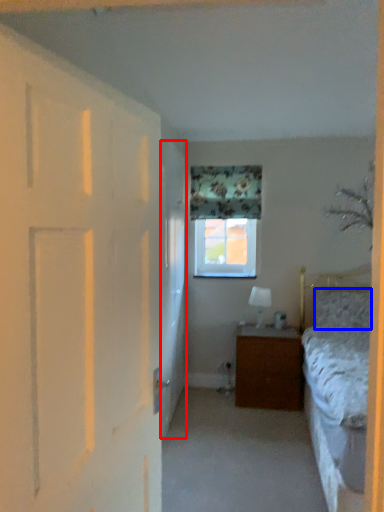
Question: Which point is closer to the camera, screen door (highlighted by a red box) or pillow (highlighted by a blue box)?

Choices:
 (A) screen door
 (B) pillow

Answer: (A)